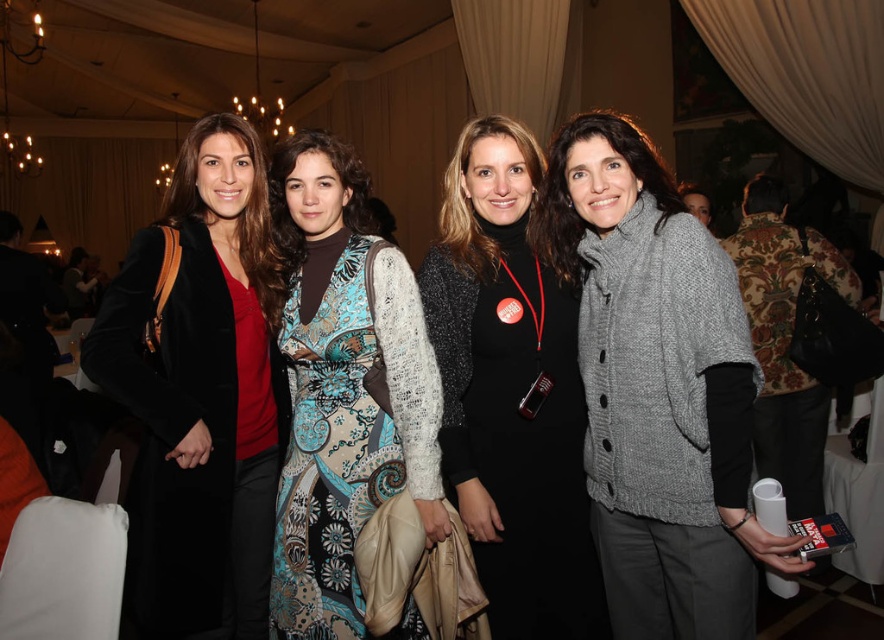
You are a photographer at an event and need to adjust the camera settings to ensure both the matte black coat at left and the patterned fabric dress at center are in focus. Considering their heights, which object should you focus on first to ensure depth of field covers both?

The matte black coat at left is taller than the patterned fabric dress at center. To ensure depth of field covers both, focus on the taller object first, which is the matte black coat at left.

You are a photographer at the event and want to ensure all attendees are properly framed. Given the positions of the matte black coat at left and the patterned fabric dress at center, which object is positioned lower in the image?

The matte black coat at left is positioned below the patterned fabric dress at center, so it is lower in the image.

You are a photographer at the event and need to adjust the lighting to ensure both the matte black coat at left and the black glitter dress at center are well illuminated. Considering their positions, which object is closer to the floor and might need more downward lighting?

The matte black coat at left is positioned under the black glitter dress at center, so it is closer to the floor and would require more downward lighting to ensure proper illumination.